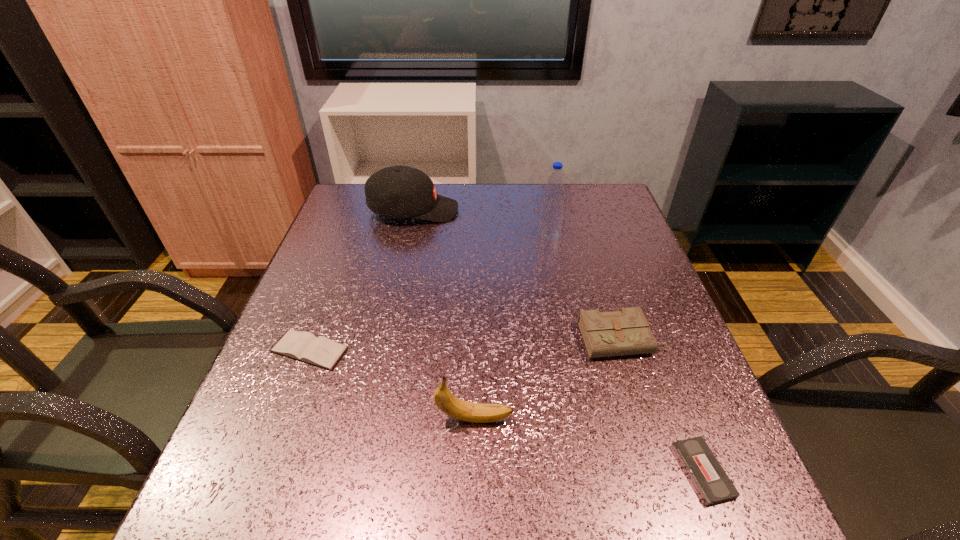
The image size is (960, 540). Identify the location of diary present at the right edge. (626, 332).

Find the location of `videotape situated at the right edge`. videotape situated at the right edge is located at coordinates [x=713, y=485].

At what (x,y) coordinates should I click in order to perform the action: click on object located in the far left corner section of the desktop. Please return your answer as a coordinate pair (x, y). The height and width of the screenshot is (540, 960). Looking at the image, I should click on (400, 191).

Find the location of a particular element. The height and width of the screenshot is (540, 960). object present at the near right corner is located at coordinates (713, 485).

This screenshot has height=540, width=960. I want to click on vacant space at the far edge of the desktop, so (541, 196).

This screenshot has height=540, width=960. What are the coordinates of `vacant space at the near edge of the desktop` in the screenshot? It's located at (544, 485).

The height and width of the screenshot is (540, 960). Find the location of `free point at the left edge`. free point at the left edge is located at coordinates (348, 294).

Where is `vacant space at the right edge of the desktop`? The width and height of the screenshot is (960, 540). vacant space at the right edge of the desktop is located at coordinates (666, 316).

The width and height of the screenshot is (960, 540). In the image, there is a desktop. In order to click on free region at the far left corner in this screenshot , I will do `click(353, 199)`.

This screenshot has width=960, height=540. Identify the location of vacant space at the near left corner of the desktop. (283, 504).